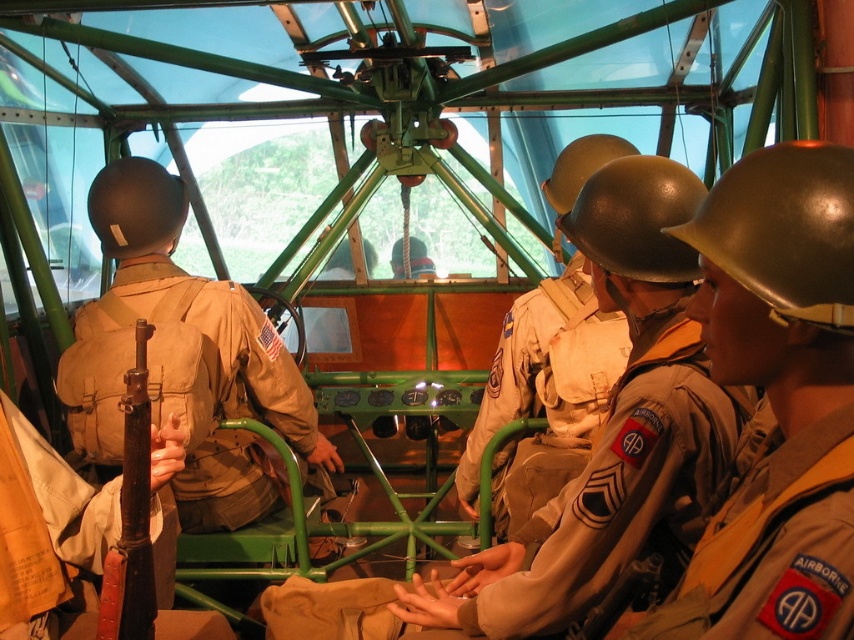
You are a military historian examining the image. You notice two items at the center of the scene. Which one is taller, the tan fabric uniform at center or the tan fabric patch at center?

The tan fabric uniform at center is taller than the tan fabric patch at center.

In the scene shown: You are a military historian examining the image of the aircraft interior. You notice the shiny silver helmet at center and the tan fabric patch at center. Which object is positioned to the right side of the other?

The shiny silver helmet at center is to the right of the tan fabric patch at center, so the shiny silver helmet at center is positioned to the right of the tan fabric patch at center.